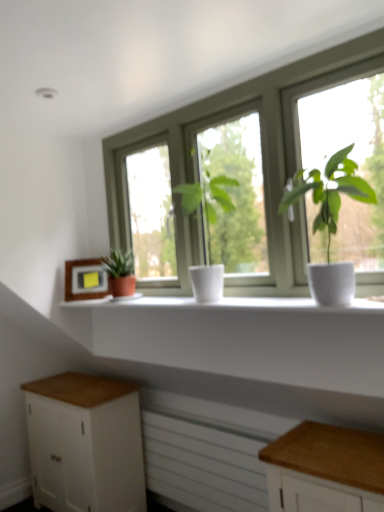
The height and width of the screenshot is (512, 384). Identify the location of free space above white wood cabinet at lower left (from a real-world perspective). (66, 382).